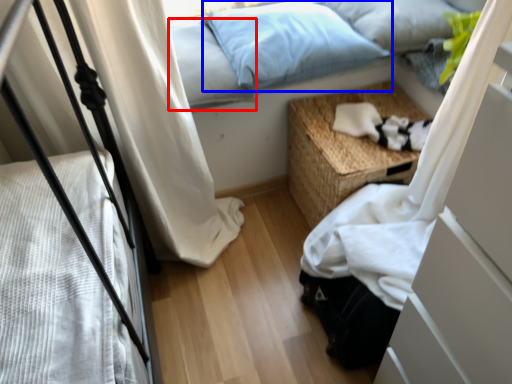
Question: Which object appears farthest to the camera in this image, pillow (highlighted by a red box) or pillow (highlighted by a blue box)?

Choices:
 (A) pillow
 (B) pillow

Answer: (B)